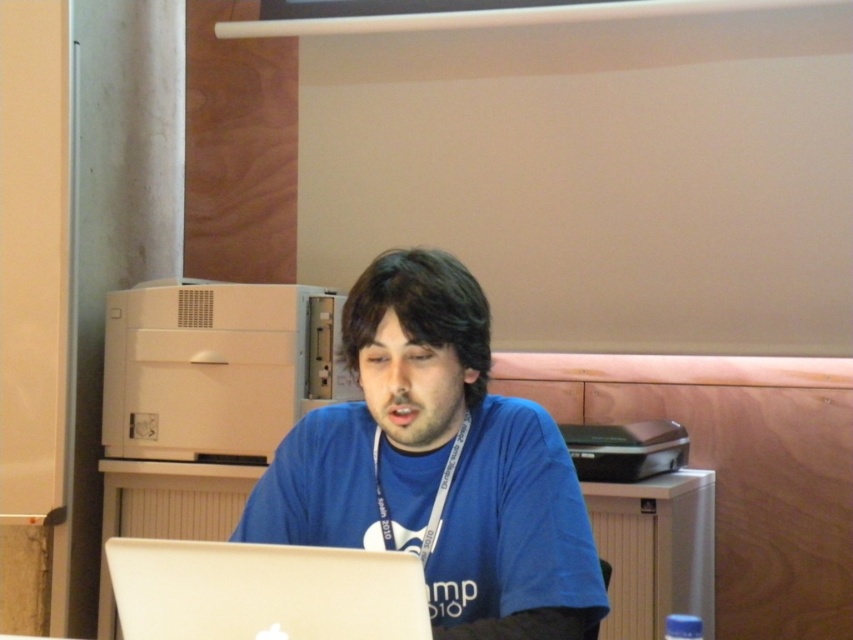
You are standing in front of the desk and want to reach both points marked on the image. Which point, point (585,560) or point (306,605), is closer to you?

Point (306,605) is closer to you because it is less further to the camera than point (585,560).

You are trying to determine which object takes up more space in the image. Looking at the blue fabric shirt at center and the silver metallic laptop at lower center, which one is larger?

The blue fabric shirt at center is bigger than the silver metallic laptop at lower center, so the blue fabric shirt at center takes up more space in the image.